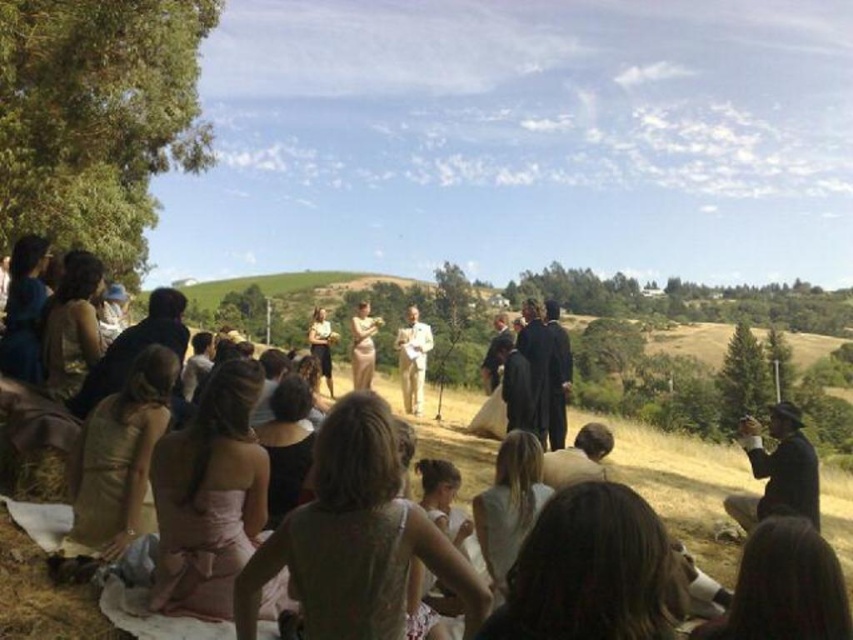
You are a photographer at the wedding ceremony. You want to capture a photo of the light beige suit at center without any obstructions. The black leather hat at lower right is currently blocking the view. Based on their positions, can you adjust your camera angle to avoid the hat?

The black leather hat at lower right is in front of the light beige suit at center, so you can move your camera angle slightly to the left or right to avoid the obstruction caused by the hat.

Consider the image. You are a photographer at the wedding ceremony. You need to capture a photo of the matte white dress at center and the black leather hat at lower right. Based on their sizes, which object might require more space in the frame?

The matte white dress at center might require more space in the frame since it is wider than the black leather hat at lower right according to the description.

You are a photographer at the wedding ceremony. You need to capture a photo that includes both the black leather hat at lower right and the light beige suit at center. However, the hat is currently blocking part of the suit in the frame. How can you adjust your position to ensure both are fully visible without any obstruction?

Move your position so that the black leather hat at lower right is no longer in front of the light beige suit at center. Since the black leather hat at lower right is positioned under the light beige suit at center, moving to the side or angle your camera upwards would allow both to be visible without obstruction.